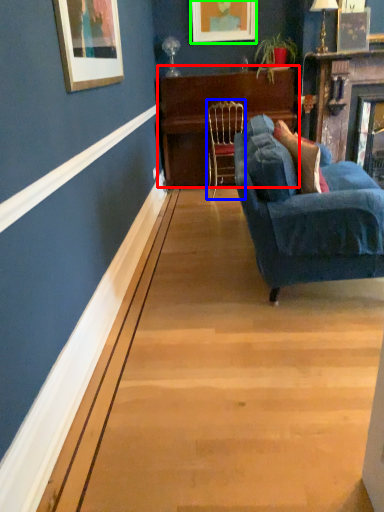
Question: Which is farther away from table (highlighted by a red box)? chair (highlighted by a blue box) or picture frame (highlighted by a green box)?

Choices:
 (A) chair
 (B) picture frame

Answer: (B)